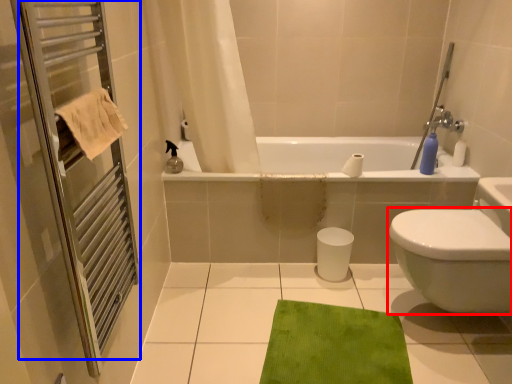
Question: Which object appears closest to the camera in this image, bidet (highlighted by a red box) or screen door (highlighted by a blue box)?

Choices:
 (A) bidet
 (B) screen door

Answer: (B)